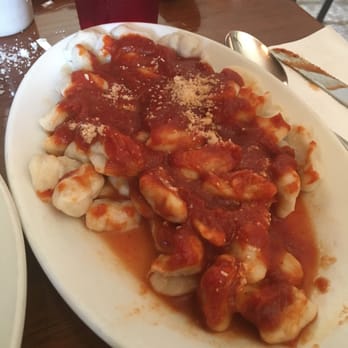
Identify the location of spoon. Image resolution: width=348 pixels, height=348 pixels. (259, 55).